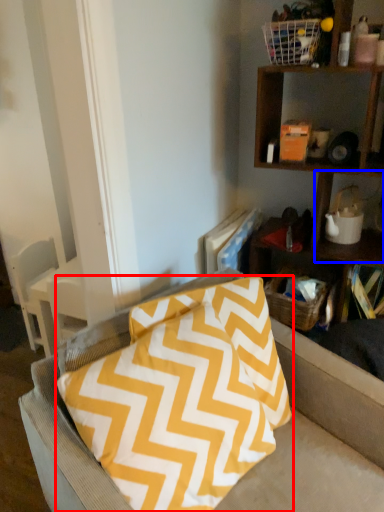
Question: Which object is further to the camera taking this photo, pillow (highlighted by a red box) or cabinet (highlighted by a blue box)?

Choices:
 (A) pillow
 (B) cabinet

Answer: (B)